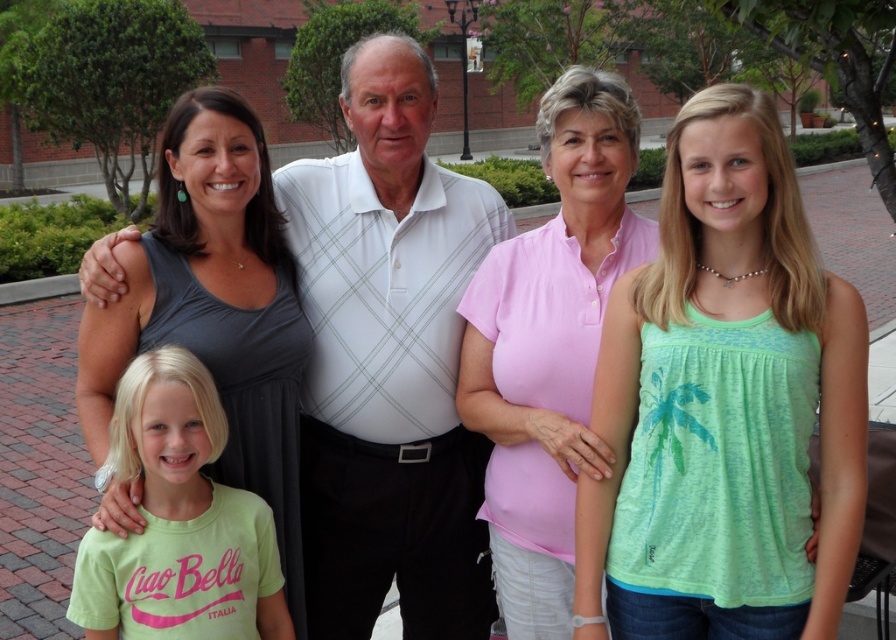
Question: Is gray matte tank top at left thinner than green cotton shirt at lower left?

Choices:
 (A) yes
 (B) no

Answer: (B)

Question: Which object is positioned closest to the white textured polo shirt at center?

Choices:
 (A) gray matte tank top at left
 (B) pink cotton shirt at center
 (C) green fabric tank top at center

Answer: (A)

Question: Which object is positioned farthest from the white textured polo shirt at center?

Choices:
 (A) pink cotton shirt at center
 (B) green cotton shirt at lower left
 (C) green fabric tank top at center

Answer: (C)

Question: Does white textured polo shirt at center have a greater width compared to green cotton shirt at lower left?

Choices:
 (A) no
 (B) yes

Answer: (B)

Question: Among these objects, which one is farthest from the camera?

Choices:
 (A) green fabric tank top at center
 (B) white textured polo shirt at center
 (C) green cotton shirt at lower left

Answer: (B)

Question: Can you confirm if green fabric tank top at center is positioned below pink cotton shirt at center?

Choices:
 (A) no
 (B) yes

Answer: (A)